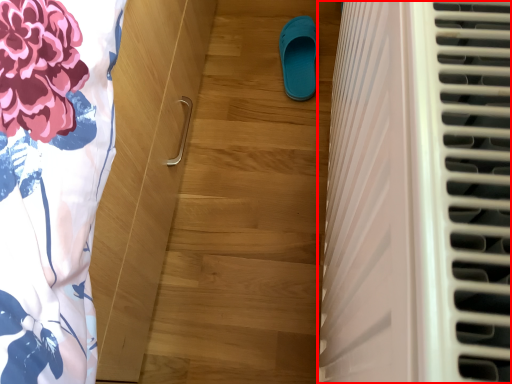
Question: From the image's perspective, where is air conditioning (annotated by the red box) located relative to footwear?

Choices:
 (A) above
 (B) below

Answer: (B)